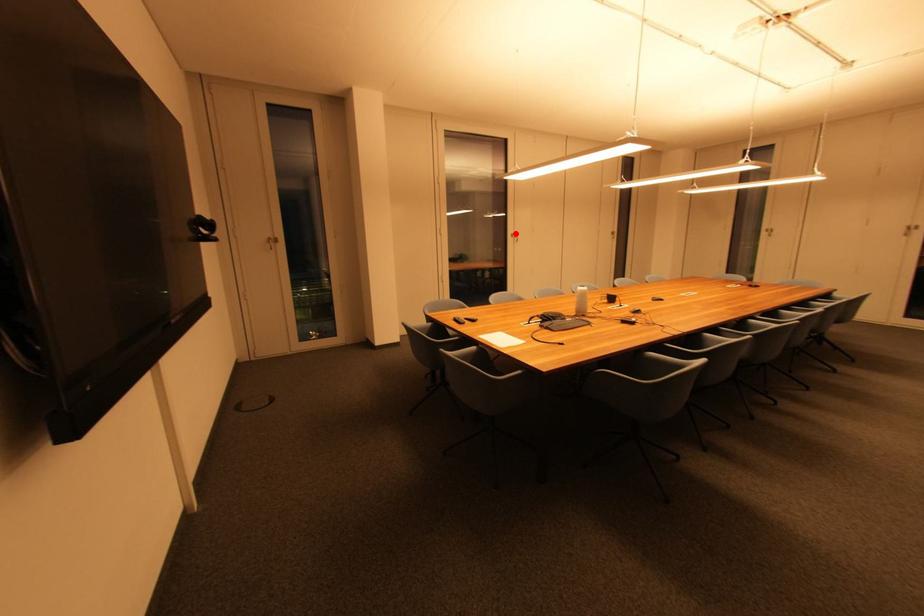
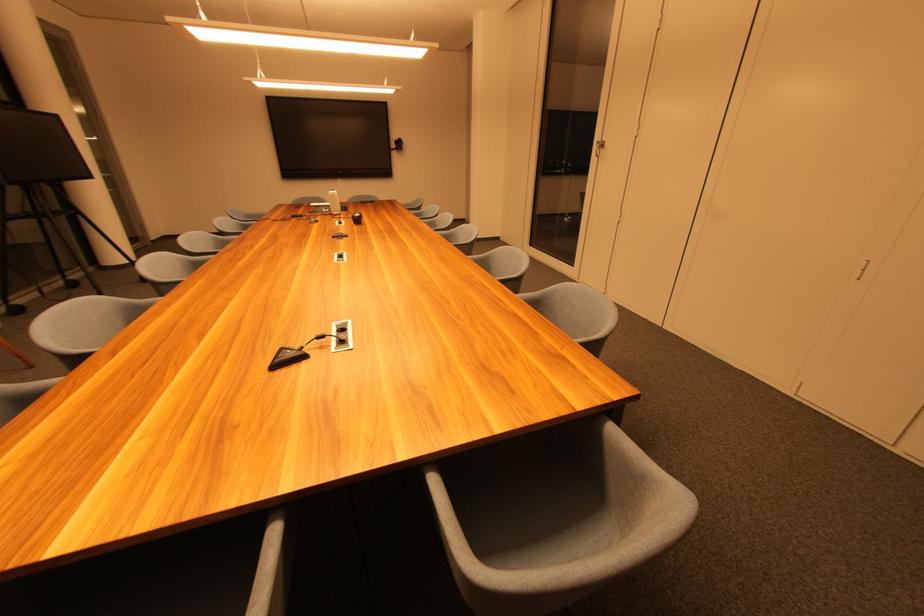
The point at the highlighted location is marked in the first image. Where is the corresponding point in the second image?

(602, 140)